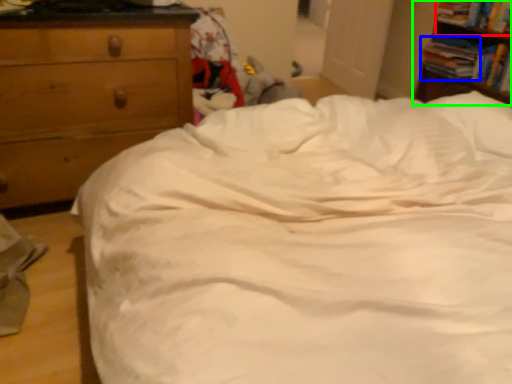
Question: Considering the real-world distances, which object is farthest from book (highlighted by a red box)? book (highlighted by a blue box) or nightstand (highlighted by a green box)?

Choices:
 (A) book
 (B) nightstand

Answer: (A)